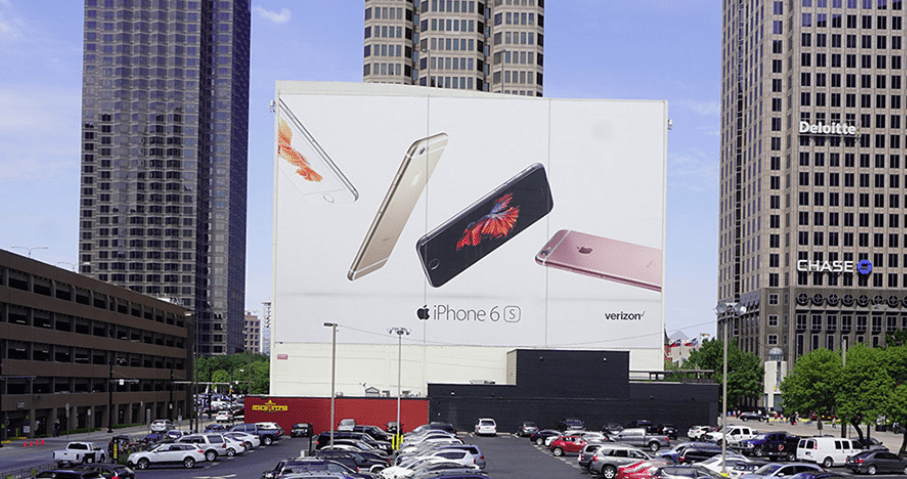
Where is `black wall`? black wall is located at coordinates (600, 391).